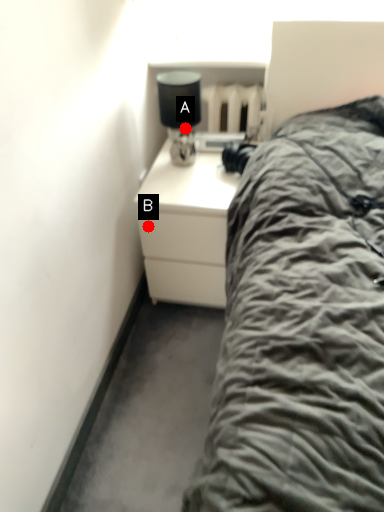
Question: Two points are circled on the image, labeled by A and B beside each circle. Which point is further to the camera?

Choices:
 (A) A is further
 (B) B is further

Answer: (A)